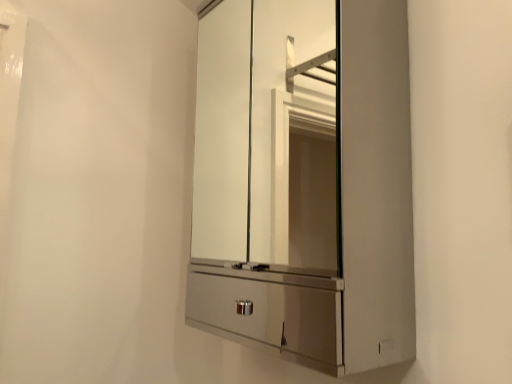
Image resolution: width=512 pixels, height=384 pixels. What do you see at coordinates (304, 182) in the screenshot? I see `satin silver cabinet at center` at bounding box center [304, 182].

You are a GUI agent. You are given a task and a screenshot of the screen. Output one action in this format:
    pyautogui.click(x=<x>, y=<y>)
    Task: Click on the satin silver cabinet at center
    The image size is (512, 384).
    Given the screenshot: What is the action you would take?
    pyautogui.click(x=304, y=182)

Identify the location of satin silver cabinet at center. This screenshot has width=512, height=384. (304, 182).